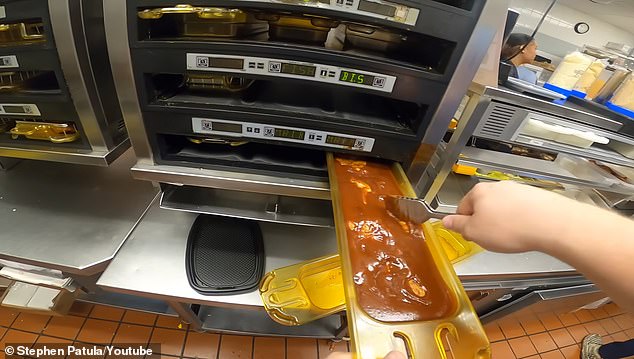
You are a GUI agent. You are given a task and a screenshot of the screen. Output one action in this format:
    pyautogui.click(x=<x>, y=<y>)
    Task: Click on the clock
    The image size is (634, 359).
    Given the screenshot: What is the action you would take?
    pyautogui.click(x=581, y=27)